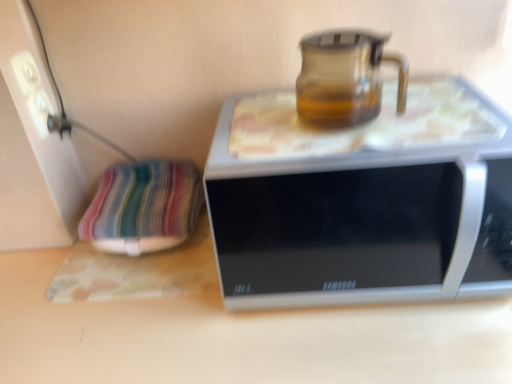
Locate an element on the screen. free location above smooth wooden table at center (from a real-world perspective) is located at coordinates (145, 301).